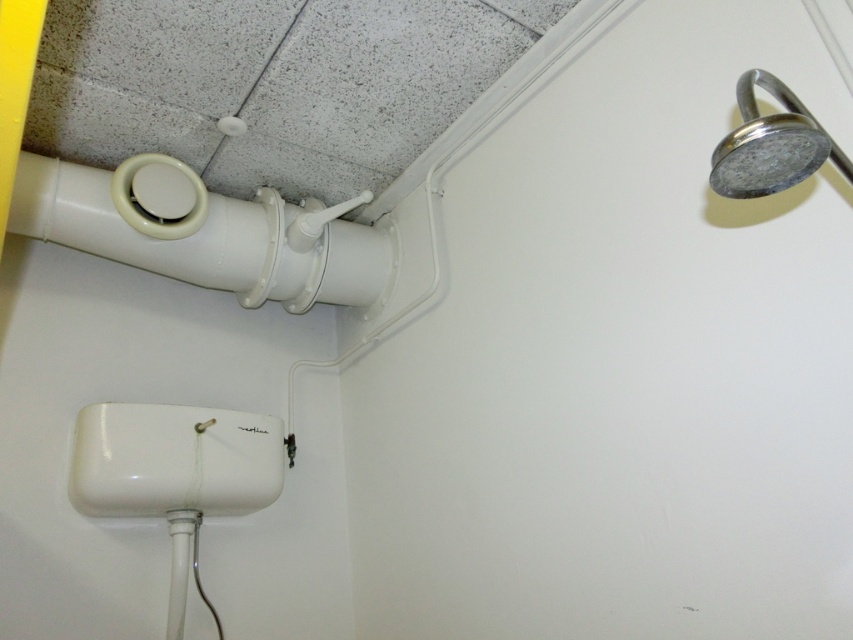
What do you see at coordinates (202, 230) in the screenshot? Image resolution: width=853 pixels, height=640 pixels. I see `white plastic pipe at upper left` at bounding box center [202, 230].

Which is in front, point (148, 189) or point (172, 632)?

Point (172, 632)

You are a GUI agent. You are given a task and a screenshot of the screen. Output one action in this format:
    pyautogui.click(x=<x>, y=<y>)
    Task: Click on the white plastic pipe at upper left
    The width and height of the screenshot is (853, 640).
    Given the screenshot: What is the action you would take?
    pyautogui.click(x=202, y=230)

Which is more to the left, chrome metallic shower head at upper right or white glossy pipe at lower left?

white glossy pipe at lower left

Does chrome metallic shower head at upper right have a greater height compared to white glossy pipe at lower left?

Incorrect, chrome metallic shower head at upper right's height is not larger of white glossy pipe at lower left's.

Which is in front, point (793, 99) or point (171, 545)?

Positioned in front is point (793, 99).

Where is `chrome metallic shower head at upper right`? The width and height of the screenshot is (853, 640). chrome metallic shower head at upper right is located at coordinates (770, 145).

Is white plastic pipe at upper left to the right of chrome metallic shower head at upper right from the viewer's perspective?

In fact, white plastic pipe at upper left is to the left of chrome metallic shower head at upper right.

Between point (161, 180) and point (799, 115), which one is positioned behind?

The point (161, 180) is behind.

Is point (351, 259) closer to viewer compared to point (813, 172)?

No.

This screenshot has height=640, width=853. Find the location of `white plastic pipe at upper left`. white plastic pipe at upper left is located at coordinates (202, 230).